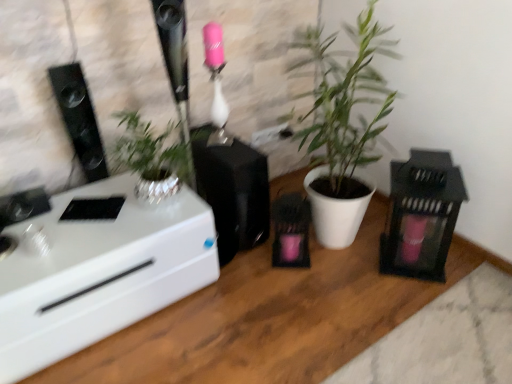
Identify the location of free space in front of black matte lantern at right, which is the 2th appliance from left to right. (432, 302).